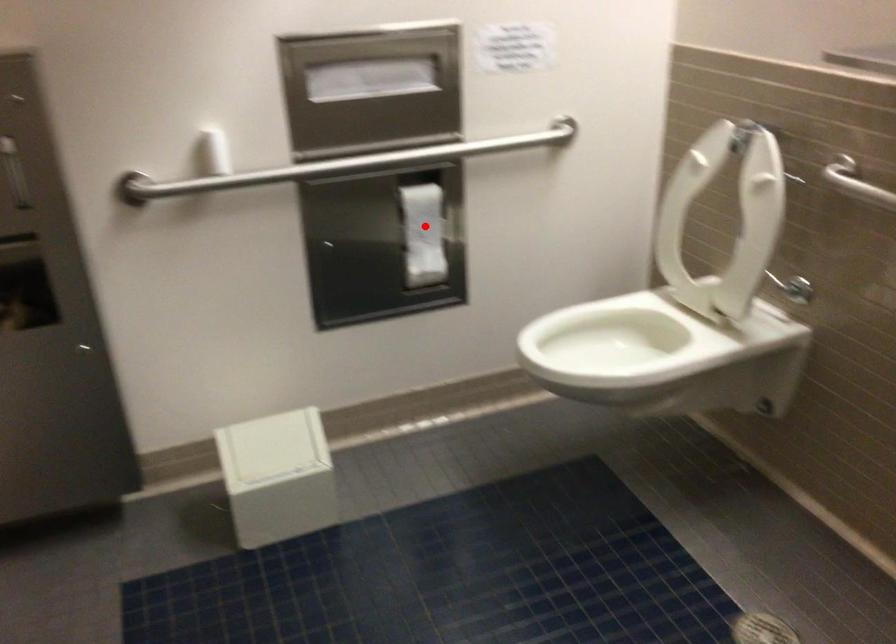
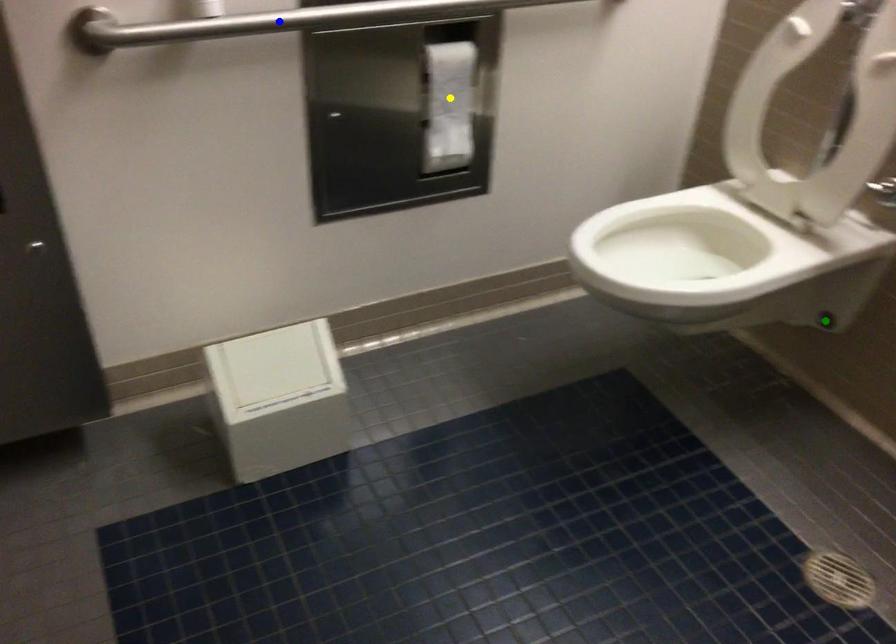
Question: I am providing you with two images of the same scene from different viewpoints. A red point is marked on the first image. You are given multiple points on the second image. In image 2, which mark is for the same physical point as the one in image 1?

Choices:
 (A) green point
 (B) blue point
 (C) yellow point

Answer: (C)